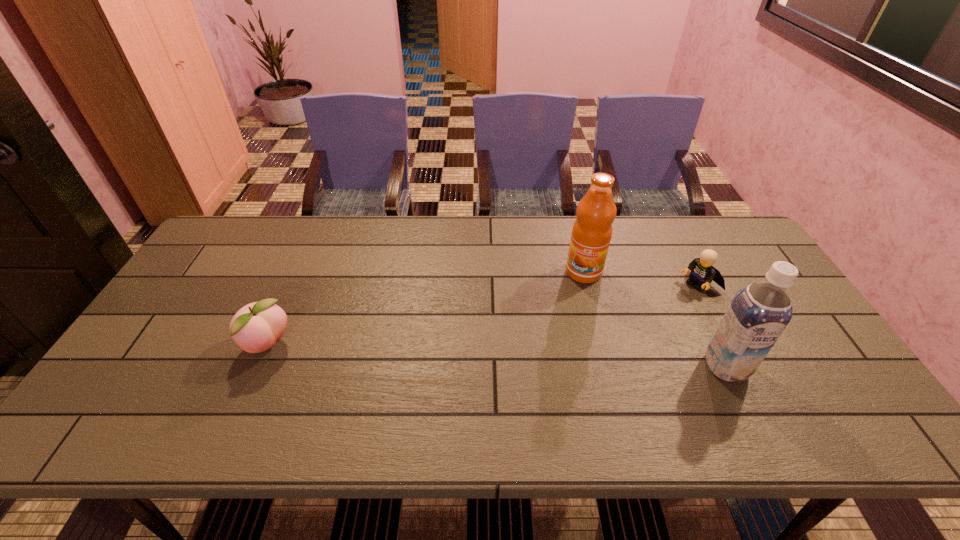
Identify the location of free space between the second object from left to right and the peach. The height and width of the screenshot is (540, 960). click(x=425, y=309).

Where is `empty location between the Lego and the soya milk`? empty location between the Lego and the soya milk is located at coordinates (712, 325).

In order to click on empty space between the soya milk and the third object from right to left in this screenshot , I will do `click(655, 319)`.

At what (x,y) coordinates should I click in order to perform the action: click on free space between the leftmost object and the Lego. Please return your answer as a coordinate pair (x, y). This screenshot has width=960, height=540. Looking at the image, I should click on (483, 314).

At what (x,y) coordinates should I click in order to perform the action: click on free area in between the soya milk and the peach. Please return your answer as a coordinate pair (x, y). The image size is (960, 540). Looking at the image, I should click on (497, 356).

Identify the location of free space between the Lego and the leftmost object. (483, 314).

Find the location of `free space between the fruit juice and the Lego`. free space between the fruit juice and the Lego is located at coordinates (640, 278).

Select which object appears as the second closest to the Lego. Please provide its 2D coordinates. Your answer should be formatted as a tuple, i.e. [(x, y)], where the tuple contains the x and y coordinates of a point satisfying the conditions above.

[(591, 234)]

Locate which object is the second closest to the soya milk. Please provide its 2D coordinates. Your answer should be formatted as a tuple, i.e. [(x, y)], where the tuple contains the x and y coordinates of a point satisfying the conditions above.

[(591, 234)]